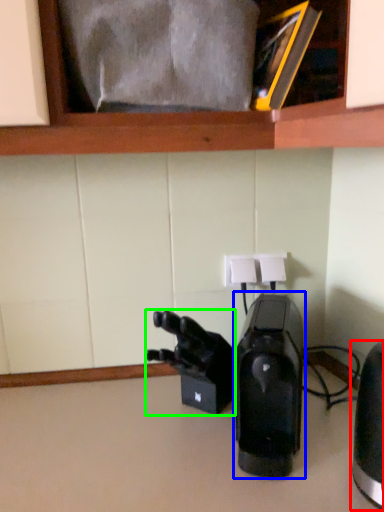
Question: Which object is the closest to the home appliance (highlighted by a red box)? Choose among these: home appliance (highlighted by a blue box) or video camera (highlighted by a green box).

Choices:
 (A) home appliance
 (B) video camera

Answer: (A)